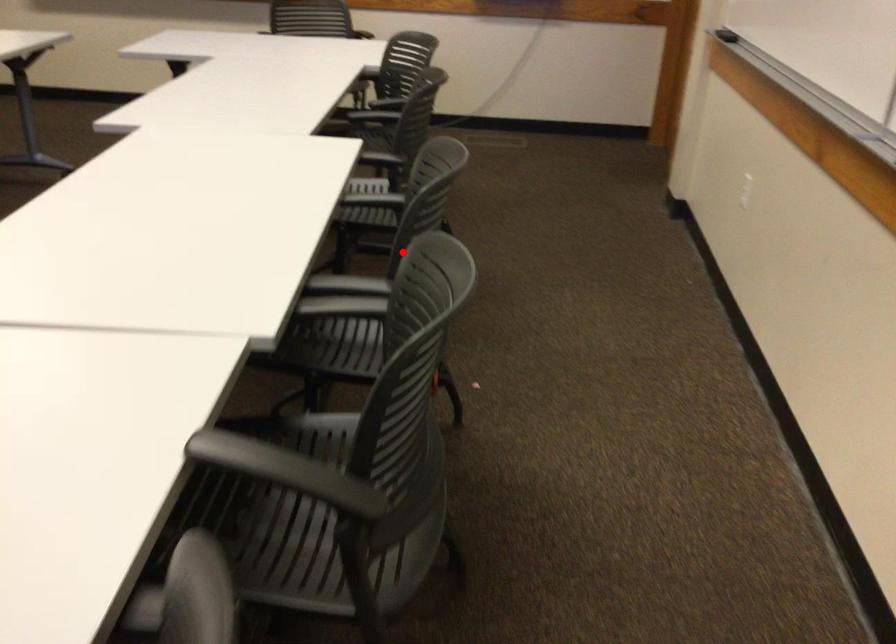
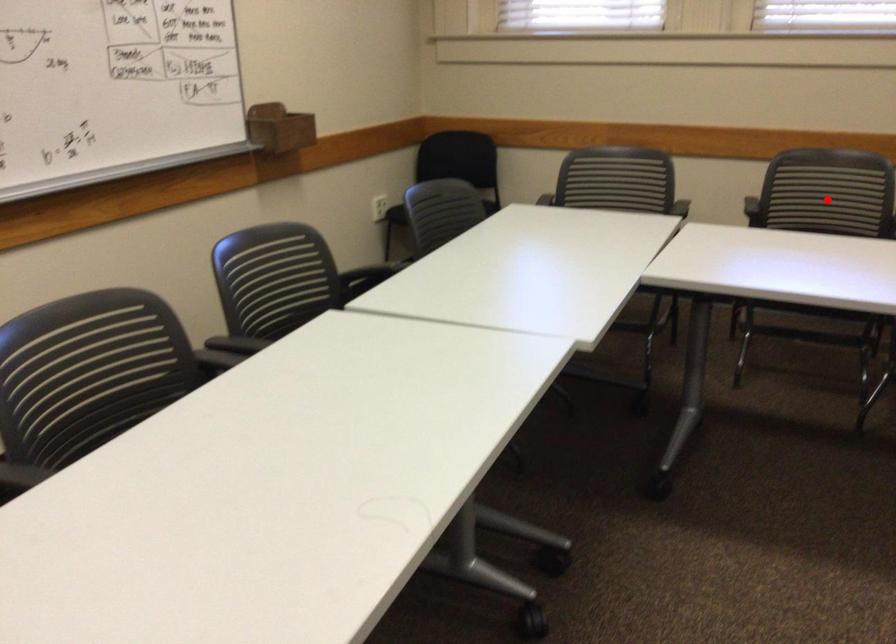
I am providing you with two images of the same scene from different viewpoints. A red point is marked on the first image and another point is marked on the second image. Is the red point in image1 aligned with the point shown in image2?

No